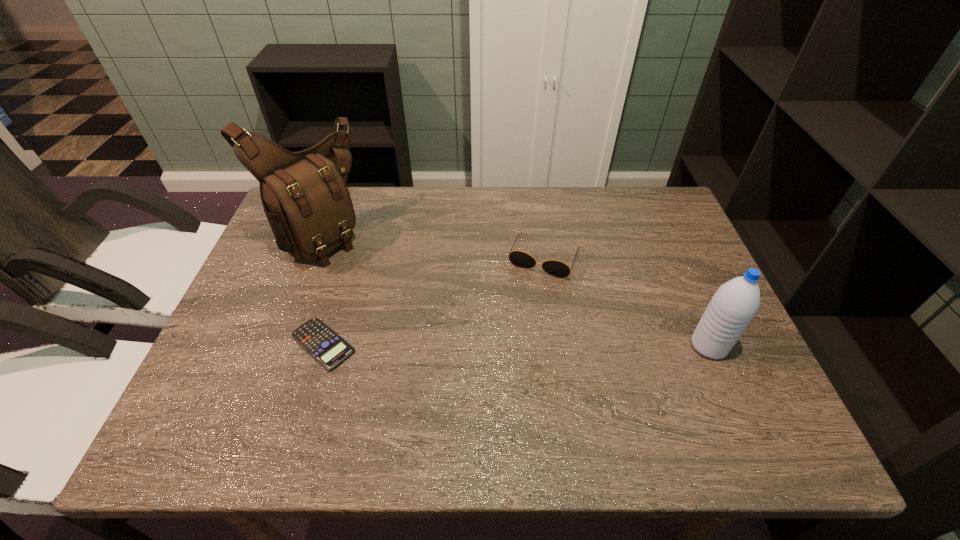
You are a GUI agent. You are given a task and a screenshot of the screen. Output one action in this format:
    pyautogui.click(x=<x>, y=<y>)
    Task: Click on the free spot on the desktop that is between the calculator and the rightmost object and is positioned on the front-facing side of the shoulder bag
    The image size is (960, 540).
    Given the screenshot: What is the action you would take?
    pyautogui.click(x=494, y=345)

Find the location of `vacant space on the desktop that is between the calculator and the second tallest object and is positioned on the front-facing side of the second object from right to left`. vacant space on the desktop that is between the calculator and the second tallest object and is positioned on the front-facing side of the second object from right to left is located at coordinates (507, 345).